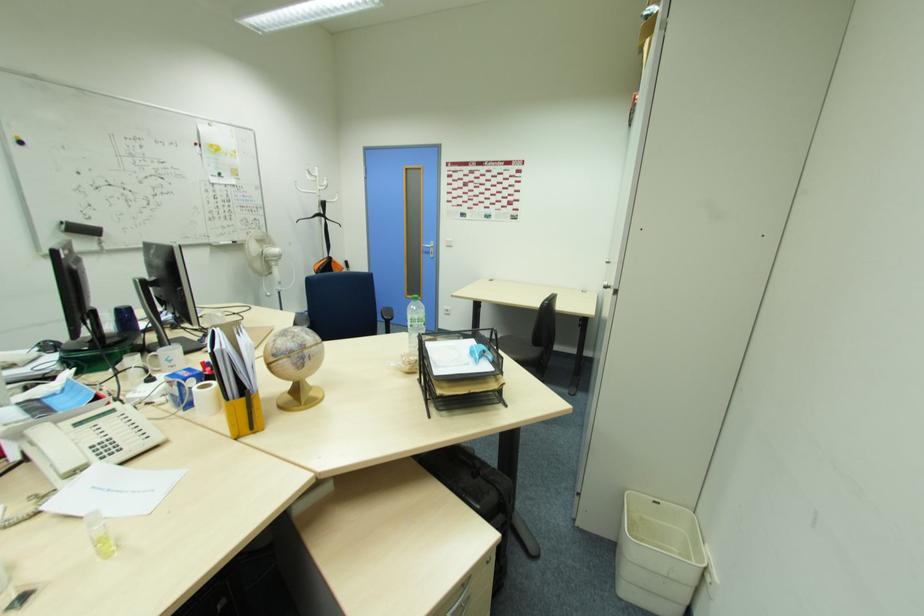
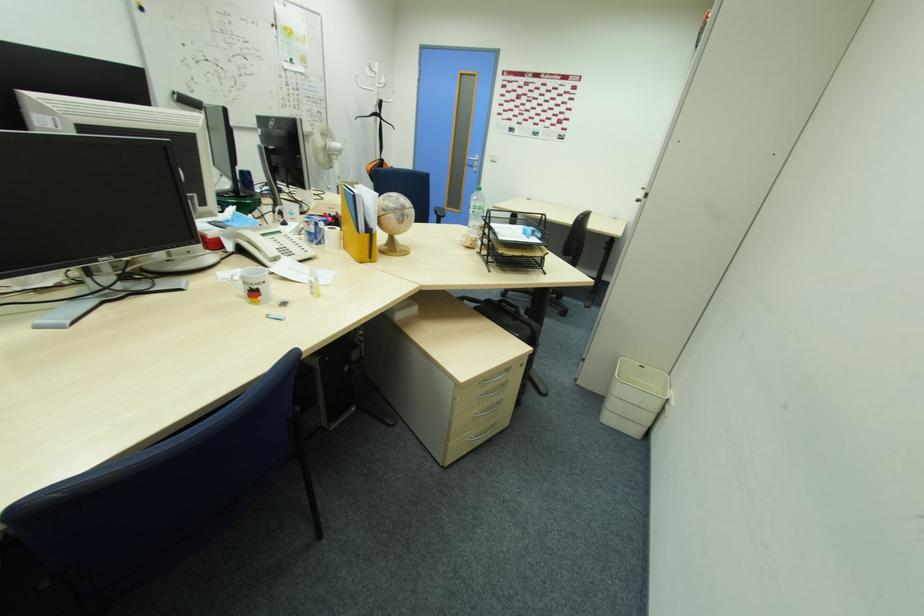
In a continuous first-person perspective shot, in which direction is the camera moving?

The cameraman walked toward left, backward.